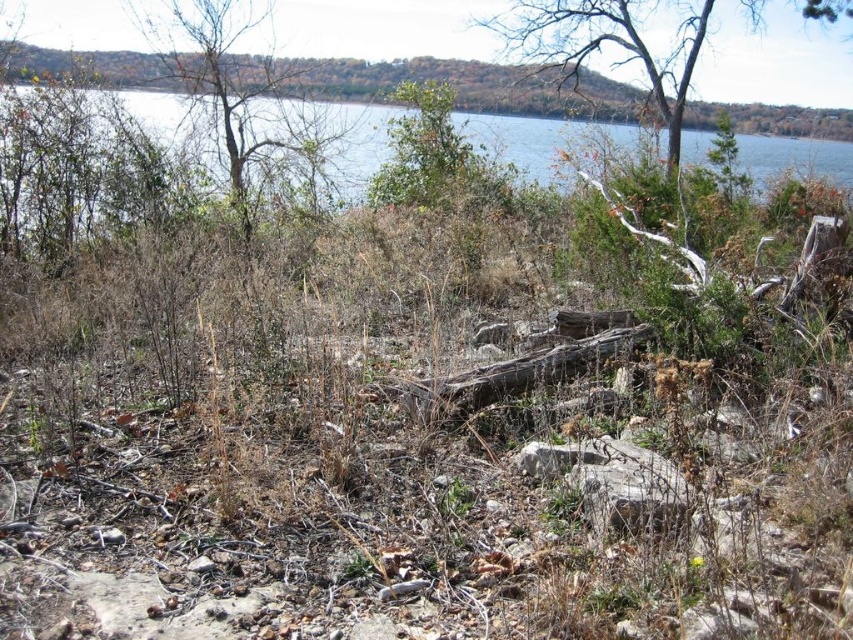
Image resolution: width=853 pixels, height=640 pixels. In order to click on bare wood tree at upper center in this screenshot , I will do `click(610, 44)`.

Does bare wood tree at upper center appear on the left side of brown leafy tree at upper center?

No, bare wood tree at upper center is not to the left of brown leafy tree at upper center.

Which is in front, point (706, 22) or point (138, 17)?

Positioned in front is point (138, 17).

This screenshot has width=853, height=640. What are the coordinates of `bare wood tree at upper center` in the screenshot? It's located at (610, 44).

Does blue water at upper center have a greater height compared to brown rough tree trunk at center?

Indeed, blue water at upper center has a greater height compared to brown rough tree trunk at center.

Which is behind, point (560, 134) or point (442, 387)?

The point (560, 134) is more distant.

Which is in front, point (164, 122) or point (438, 413)?

Point (438, 413)

This screenshot has height=640, width=853. In order to click on blue water at upper center in this screenshot , I will do `click(544, 140)`.

Which is more to the left, blue water at upper center or brown leafy tree at upper center?

brown leafy tree at upper center is more to the left.

Is blue water at upper center closer to the viewer compared to brown leafy tree at upper center?

No, it is behind brown leafy tree at upper center.

The width and height of the screenshot is (853, 640). In order to click on blue water at upper center in this screenshot , I will do `click(544, 140)`.

What are the coordinates of `blue water at upper center` in the screenshot? It's located at (544, 140).